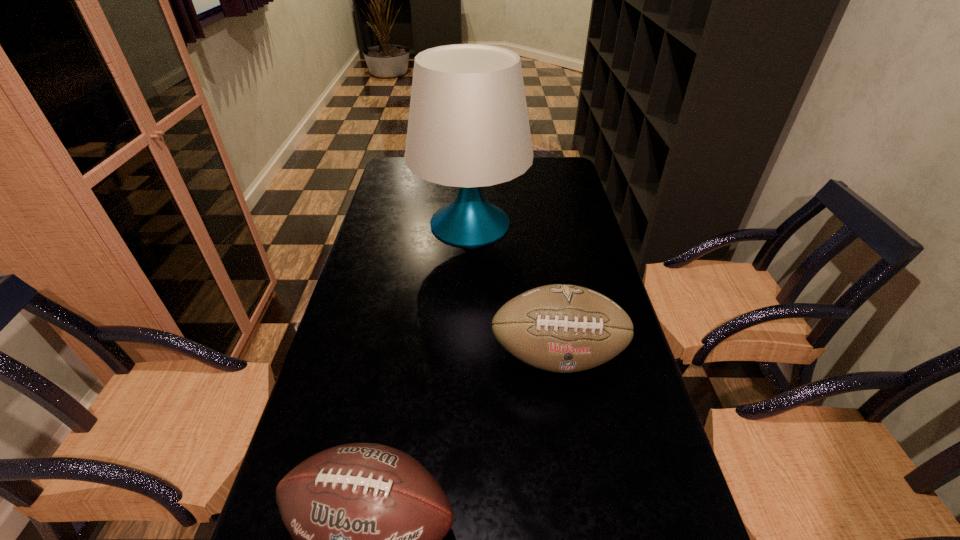
Where is `the tallest object`? This screenshot has width=960, height=540. the tallest object is located at coordinates (468, 127).

The image size is (960, 540). In order to click on table lamp in this screenshot , I will do `click(468, 127)`.

Find the location of a particular element. This screenshot has width=960, height=540. the right football (American) is located at coordinates (559, 328).

This screenshot has width=960, height=540. What are the coordinates of `the farther football (American)` in the screenshot? It's located at (559, 328).

At what (x,y) coordinates should I click in order to perform the action: click on free spot located 0.120m on the front-facing side of the farthest object. Please return your answer as a coordinate pair (x, y). The width and height of the screenshot is (960, 540). Looking at the image, I should click on (564, 222).

Where is `free space located on the laces of the right football (American)`? This screenshot has width=960, height=540. free space located on the laces of the right football (American) is located at coordinates (583, 506).

The height and width of the screenshot is (540, 960). What are the coordinates of `object that is at the left edge` in the screenshot? It's located at (468, 127).

Identify the location of object located at the right edge. This screenshot has width=960, height=540. (559, 328).

Identify the location of free space at the left edge. This screenshot has height=540, width=960. (394, 220).

Locate an element on the screen. vacant region at the right edge of the desktop is located at coordinates (596, 428).